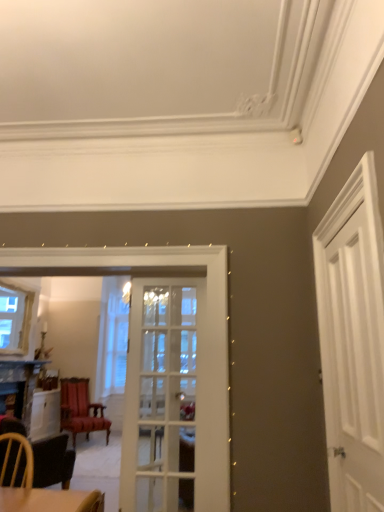
Image resolution: width=384 pixels, height=512 pixels. What do you see at coordinates (353, 365) in the screenshot? I see `white wooden door at right, placed as the 1th door when sorted from front to back` at bounding box center [353, 365].

I want to click on clear glass window at left, so click(x=15, y=319).

Locate an element on the screen. white wooden door at right, the second door positioned from the back is located at coordinates (353, 365).

Does velvet red chair at center have a greater height compared to white glass door at center, the 2th door when ordered from front to back?

Incorrect, the height of velvet red chair at center is not larger of that of white glass door at center, the 2th door when ordered from front to back.

What's the angular difference between velvet red chair at center and white glass door at center, the 2th door when ordered from front to back,'s facing directions?

There is a 45.2-degree angle between the facing directions of velvet red chair at center and white glass door at center, the 2th door when ordered from front to back.

Is velvet red chair at center looking in the opposite direction of white glass door at center, which ranks as the first door in back-to-front order?

No, white glass door at center, which ranks as the first door in back-to-front order, is not at the back of velvet red chair at center.

Is velvet red chair at center positioned behind white glass door at center, which ranks as the first door in back-to-front order?

Yes, velvet red chair at center is behind white glass door at center, which ranks as the first door in back-to-front order.

The height and width of the screenshot is (512, 384). In order to click on door lying above the clear glass window at left (from the image's perspective) in this screenshot , I will do `click(353, 365)`.

Considering the positions of objects clear glass window at left and white wooden door at right, which is the second door in left-to-right order, in the image provided, who is behind, clear glass window at left or white wooden door at right, which is the second door in left-to-right order,?

clear glass window at left is more distant.

Which point is more distant from viewer, (x=21, y=323) or (x=363, y=351)?

The point (x=21, y=323) is farther from the camera.

Which of these two, clear glass window at left or white wooden door at right, which is the second door in left-to-right order, stands shorter?

Standing shorter between the two is clear glass window at left.

From their relative heights in the image, would you say white glass door at center, the 2th door when ordered from front to back, is taller or shorter than clear glass window at left?

Considering their sizes, white glass door at center, the 2th door when ordered from front to back, has more height than clear glass window at left.

Between white glass door at center, which ranks as the first door in back-to-front order, and clear glass window at left, which one is positioned behind?

Positioned behind is clear glass window at left.

Does point (121, 508) come closer to viewer compared to point (14, 316)?

Yes, it is in front of point (14, 316).

Considering the sizes of objects white glass door at center, which ranks as the second door in right-to-left order, and clear glass window at left in the image provided, who is thinner, white glass door at center, which ranks as the second door in right-to-left order, or clear glass window at left?

white glass door at center, which ranks as the second door in right-to-left order.

From a real-world perspective, which is physically below, velvet red chair at center or clear glass window at left?

In real-world perspective, velvet red chair at center is lower.

Is velvet red chair at center next to clear glass window at left and touching it?

velvet red chair at center and clear glass window at left are not in contact.

Measure the distance from velvet red chair at center to clear glass window at left.

velvet red chair at center is 3.75 feet from clear glass window at left.

Do you think velvet red chair at center is within clear glass window at left, or outside of it?

velvet red chair at center is outside clear glass window at left.

Is white wooden door at right, placed as the 1th door when sorted from front to back, next to white glass door at center, which is the first door from left to right?

No, white wooden door at right, placed as the 1th door when sorted from front to back, is not in contact with white glass door at center, which is the first door from left to right.

Which is correct: white wooden door at right, placed as the 1th door when sorted from front to back, is inside white glass door at center, which ranks as the second door in right-to-left order, or outside of it?

The correct answer is: outside.

This screenshot has width=384, height=512. Identify the location of door on the left of white wooden door at right, the second door positioned from the back. (160, 398).

Is white wooden door at right, placed as the 1th door when sorted from front to back, facing away from white glass door at center, the 2th door when ordered from front to back?

No.

Based on the photo, from the image's perspective, is clear glass window at left positioned above or below white glass door at center, which is the first door from left to right?

Based on their image positions, clear glass window at left is located above white glass door at center, which is the first door from left to right.

Is clear glass window at left positioned beyond the bounds of white glass door at center, the 2th door when ordered from front to back?

Yes, clear glass window at left is located beyond the bounds of white glass door at center, the 2th door when ordered from front to back.

Does clear glass window at left have a lesser width compared to white glass door at center, which is the first door from left to right?

No.

How much distance is there between clear glass window at left and white glass door at center, which is the first door from left to right?

2.67 meters.

Which object is thinner, velvet red chair at center or white wooden door at right, placed as the 1th door when sorted from front to back?

With smaller width is white wooden door at right, placed as the 1th door when sorted from front to back.

From the image's perspective, which object appears higher, velvet red chair at center or white wooden door at right, the second door positioned from the back?

white wooden door at right, the second door positioned from the back, from the image's perspective.

Between velvet red chair at center and white wooden door at right, which is the second door in left-to-right order, which one has less height?

velvet red chair at center.

In the image, there is a white glass door at center, the 2th door when ordered from front to back. Where is `chair below it (from the image's perspective)`? chair below it (from the image's perspective) is located at coordinates (80, 410).

You are a GUI agent. You are given a task and a screenshot of the screen. Output one action in this format:
    pyautogui.click(x=<x>, y=<y>)
    Task: Click on the door located above the clear glass window at left (from the image's perspective)
    This screenshot has width=384, height=512.
    Given the screenshot: What is the action you would take?
    pyautogui.click(x=353, y=365)

Considering their positions, is clear glass window at left positioned closer to white wooden door at right, which is counted as the 1th door, starting from the right, than velvet red chair at center?

clear glass window at left is closer to white wooden door at right, which is counted as the 1th door, starting from the right.

Estimate the real-world distances between objects in this image. Which object is closer to velvet red chair at center, clear glass window at left or white wooden door at right, the second door positioned from the back?

clear glass window at left is positioned closer to the anchor velvet red chair at center.

Based on the photo, which object lies nearer to the anchor point white glass door at center, which ranks as the second door in right-to-left order, clear glass window at left or velvet red chair at center?

Based on the image, clear glass window at left appears to be nearer to white glass door at center, which ranks as the second door in right-to-left order.

Estimate the real-world distances between objects in this image. Which object is further from white glass door at center, which ranks as the first door in back-to-front order, clear glass window at left or white wooden door at right, which is the second door in left-to-right order?

clear glass window at left.

Looking at the image, which one is located further to white wooden door at right, which is the second door in left-to-right order, velvet red chair at center or white glass door at center, which is the first door from left to right?

Based on the image, velvet red chair at center appears to be further to white wooden door at right, which is the second door in left-to-right order.

Which object lies nearer to the anchor point white wooden door at right, which is the second door in left-to-right order, clear glass window at left or white glass door at center, which ranks as the first door in back-to-front order?

white glass door at center, which ranks as the first door in back-to-front order, is positioned closer to the anchor white wooden door at right, which is the second door in left-to-right order.

Looking at the image, which one is located closer to velvet red chair at center, clear glass window at left or white glass door at center, which ranks as the first door in back-to-front order?

clear glass window at left is closer to velvet red chair at center.

When comparing their distances from velvet red chair at center, does white glass door at center, the 2th door when ordered from front to back, or white wooden door at right, placed as the 1th door when sorted from front to back, seem closer?

white glass door at center, the 2th door when ordered from front to back, is closer to velvet red chair at center.

Where is `door between white wooden door at right, the second door positioned from the back, and velvet red chair at center, along the z-axis`? Image resolution: width=384 pixels, height=512 pixels. door between white wooden door at right, the second door positioned from the back, and velvet red chair at center, along the z-axis is located at coordinates (160, 398).

You are a GUI agent. You are given a task and a screenshot of the screen. Output one action in this format:
    pyautogui.click(x=<x>, y=<y>)
    Task: Click on the window positioned between white wooden door at right, placed as the 1th door when sorted from front to back, and velvet red chair at center from near to far
    This screenshot has height=512, width=384.
    Given the screenshot: What is the action you would take?
    pyautogui.click(x=15, y=319)

At what (x,y) coordinates should I click in order to perform the action: click on window between white glass door at center, which ranks as the second door in right-to-left order, and velvet red chair at center in the front-back direction. Please return your answer as a coordinate pair (x, y). The image size is (384, 512). Looking at the image, I should click on (15, 319).

At what (x,y) coordinates should I click in order to perform the action: click on door between white wooden door at right, the second door positioned from the back, and clear glass window at left from front to back. Please return your answer as a coordinate pair (x, y). The width and height of the screenshot is (384, 512). Looking at the image, I should click on (160, 398).